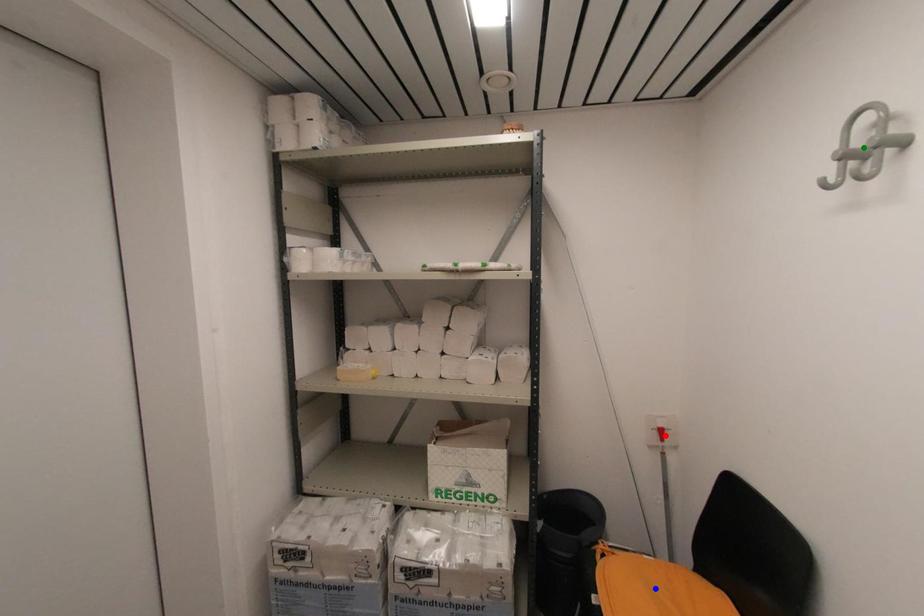
Order these from farthest to nearest:
green point
blue point
red point

red point < blue point < green point